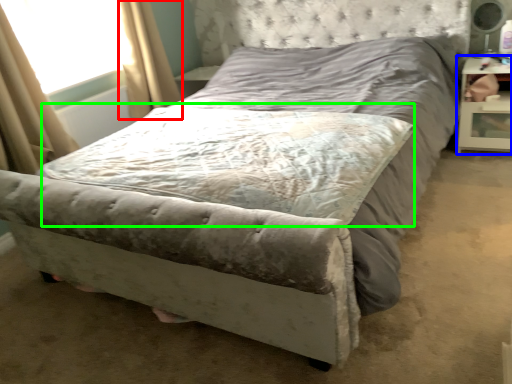
Question: Estimate the real-world distances between objects in this image. Which object is closer to curtain (highlighted by a red box), nightstand (highlighted by a blue box) or mattress (highlighted by a green box)?

Choices:
 (A) nightstand
 (B) mattress

Answer: (B)